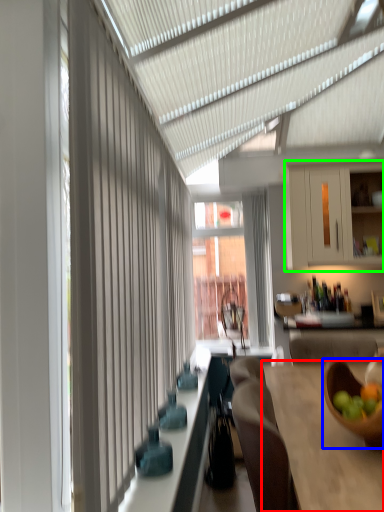
Question: Which is farther away from table (highlighted by a red box)? bowl (highlighted by a blue box) or cabinetry (highlighted by a green box)?

Choices:
 (A) bowl
 (B) cabinetry

Answer: (B)